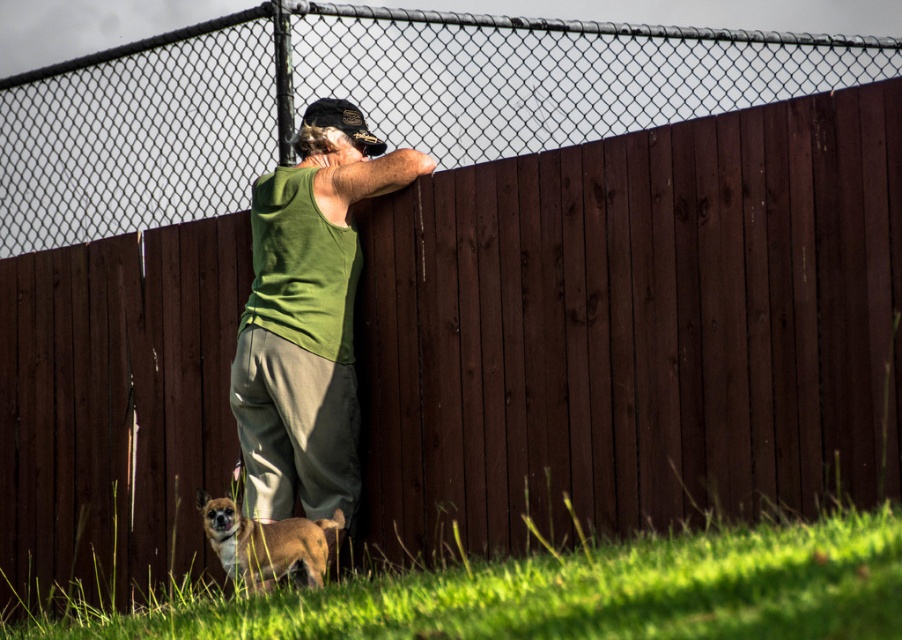
You are a photographer trying to capture a photo of the green fabric shirt at center and the brown fur dog at lower left. Since you want to ensure both subjects are in focus, you need to know their height difference. Can you tell me which one is taller?

The green fabric shirt at center is much taller than the brown fur dog at lower left.

You are a photographer trying to capture both the green fabric shirt at center and the brown fur dog at lower left in a single frame. Which subject should you focus on first to ensure both are in the frame?

The green fabric shirt at center is bigger than the brown fur dog at lower left, so you should focus on the green fabric shirt at center first to ensure both are in the frame.